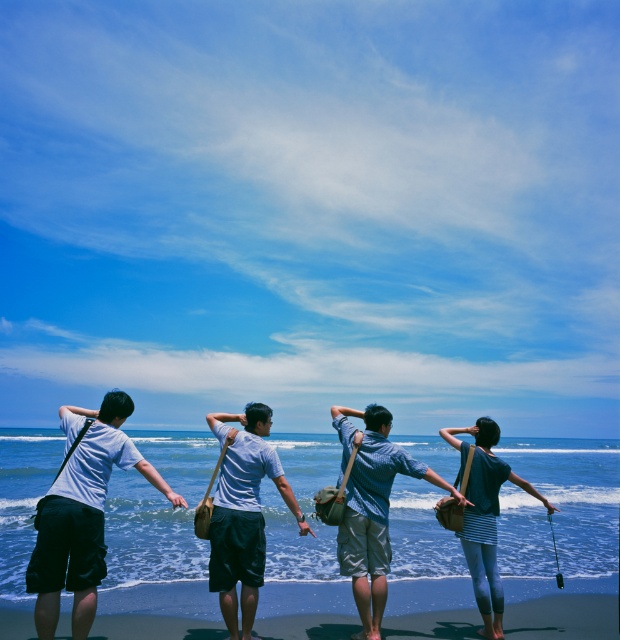
You are standing at the edge of the beach and want to walk towards the smooth sand at lower center. According to the coordinates provided, in which direction should you move relative to your current position?

The smooth sand at lower center is located at coordinates point (157,611). Since the coordinate system typically has the origin at the bottom left corner, moving towards the right and slightly upwards would align with those coordinates, so you should move to the right and slightly upwards.

You are standing at the point labeled as point (272, 586) on the beach. You want to walk straight towards the ocean. How far in feet will you have to walk to reach the water?

Since the point (272, 586) and the viewer are 31.36 feet apart, you would need to walk 31.36 feet to reach the water.